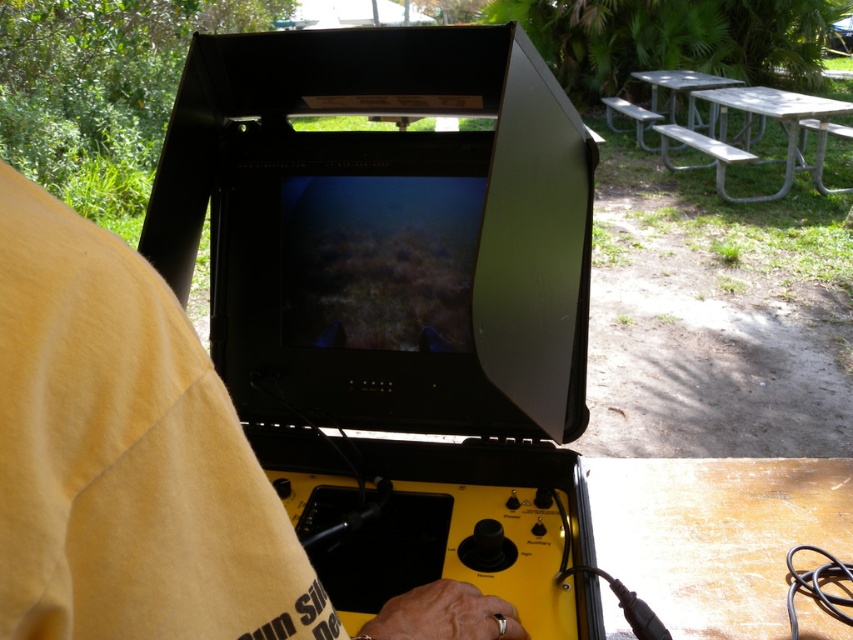
Can you confirm if yellow cotton shirt at center is positioned below wooden picnic table at lower right?

No.

Is yellow cotton shirt at center further to the viewer compared to wooden picnic table at lower right?

No, it is in front of wooden picnic table at lower right.

Between point (68, 337) and point (798, 497), which one is positioned in front?

Point (68, 337) is more forward.

Where is `yellow cotton shirt at center`? yellow cotton shirt at center is located at coordinates (125, 456).

Can you confirm if wooden picnic table at lower right is wider than silver metallic picnic table at upper right?

No, wooden picnic table at lower right is not wider than silver metallic picnic table at upper right.

Who is taller, wooden picnic table at lower right or silver metallic picnic table at upper right?

silver metallic picnic table at upper right is taller.

Which is in front, point (798, 602) or point (834, 189)?

Positioned in front is point (798, 602).

What are the coordinates of `wooden picnic table at lower right` in the screenshot? It's located at (717, 532).

Does yellow cotton shirt at center have a larger size compared to silver metallic picnic table at upper right?

No, yellow cotton shirt at center is not bigger than silver metallic picnic table at upper right.

This screenshot has height=640, width=853. What do you see at coordinates (125, 456) in the screenshot? I see `yellow cotton shirt at center` at bounding box center [125, 456].

Where is `yellow cotton shirt at center`? This screenshot has width=853, height=640. yellow cotton shirt at center is located at coordinates (125, 456).